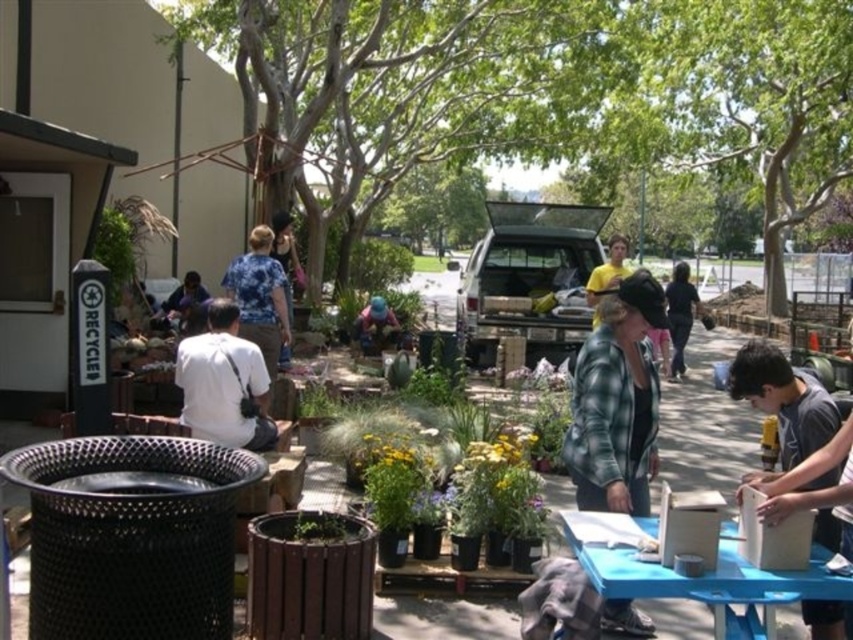
Which is behind, point (836, 586) or point (166, 300)?

The point (166, 300) is more distant.

Does blue plastic table at lower right have a lesser height compared to matte blue shirt at center?

Yes, blue plastic table at lower right is shorter than matte blue shirt at center.

At what (x,y) coordinates should I click in order to perform the action: click on blue plastic table at lower right. Please return your answer as a coordinate pair (x, y). This screenshot has width=853, height=640. Looking at the image, I should click on (701, 577).

Is black fabric at center to the right of yellow cotton shirt at center from the viewer's perspective?

Indeed, black fabric at center is positioned on the right side of yellow cotton shirt at center.

Can you confirm if black fabric at center is thinner than yellow cotton shirt at center?

Incorrect, black fabric at center's width is not less than yellow cotton shirt at center's.

Which is behind, point (683, 276) or point (596, 316)?

The point (683, 276) is more distant.

Where is `black fabric at center`? black fabric at center is located at coordinates (679, 314).

Does point (781, 380) come farther from viewer compared to point (239, 353)?

No.

Does point (822, 442) come closer to viewer compared to point (258, 406)?

Yes, it is in front of point (258, 406).

What do you see at coordinates (782, 403) in the screenshot? I see `gray cotton shirt at lower right` at bounding box center [782, 403].

Locate an element on the screen. The image size is (853, 640). gray cotton shirt at lower right is located at coordinates (782, 403).